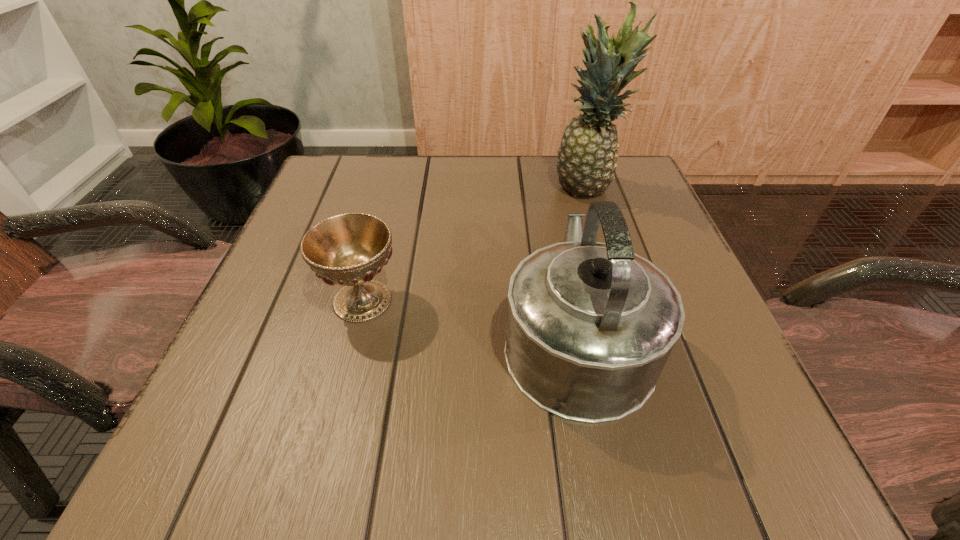
Identify the location of object that is positioned at the far edge. Image resolution: width=960 pixels, height=540 pixels. (587, 157).

Locate an element on the screen. object at the near edge is located at coordinates (590, 326).

Identify the location of object that is at the left edge. (349, 249).

Locate an element on the screen. The width and height of the screenshot is (960, 540). pineapple located at the right edge is located at coordinates (587, 157).

Where is `kettle that is positioned at the right edge`? kettle that is positioned at the right edge is located at coordinates (590, 326).

The image size is (960, 540). In order to click on object situated at the far right corner in this screenshot , I will do pos(587,157).

Where is `object positioned at the near right corner`? The height and width of the screenshot is (540, 960). object positioned at the near right corner is located at coordinates (590, 326).

Locate an element on the screen. This screenshot has height=540, width=960. vacant region at the far edge of the desktop is located at coordinates (556, 173).

In the image, there is a desktop. Where is `vacant space at the near edge`? This screenshot has height=540, width=960. vacant space at the near edge is located at coordinates 597,477.

The width and height of the screenshot is (960, 540). Find the location of `blank area at the right edge`. blank area at the right edge is located at coordinates (658, 251).